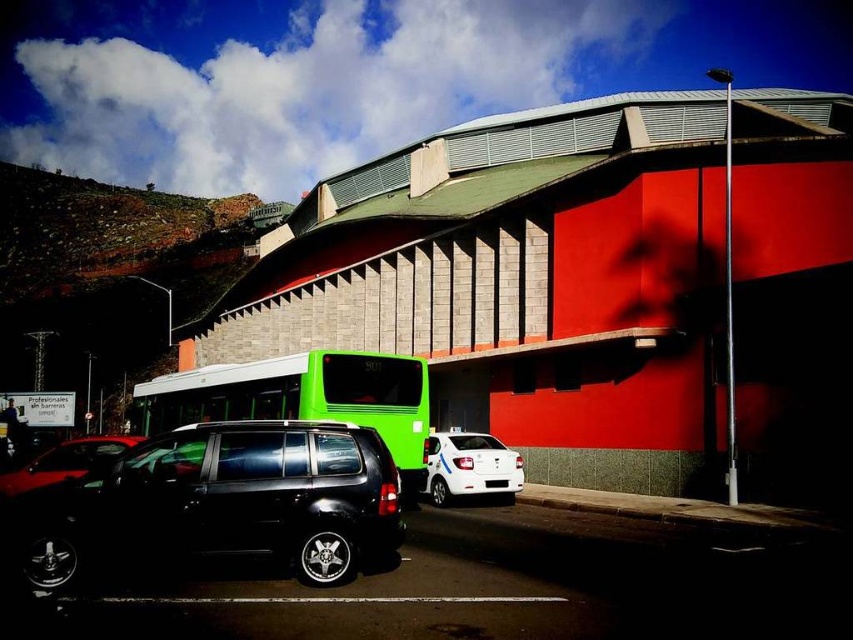
You are a delivery driver who needs to park your vehicle in a space that can accommodate your truck. You observe the white glossy car at center and the white plastic license plate at center in the scene. Which object indicates the parking space width requirement?

The white glossy car at center is wider than the white plastic license plate at center, so the parking space width requirement is indicated by the white glossy car at center since it is larger in width.

You are a delivery person needing to park your van between the green matte bus at center and the shiny black car at lower left. Your van is 6 meters long. Can you fit your van between them without moving either vehicle?

The distance between the green matte bus at center and the shiny black car at lower left is 7.54 meters. Since your van is 6 meters long, there is enough space to park it between them without moving either vehicle.

You are a delivery driver who needs to park your vehicle behind the green matte bus at center so that the white plastic license plate at center is visible from the street. Is this possible?

The green matte bus at center is in front of the white plastic license plate at center, so if you park behind the green matte bus at center, the white plastic license plate at center will still be visible from the street.